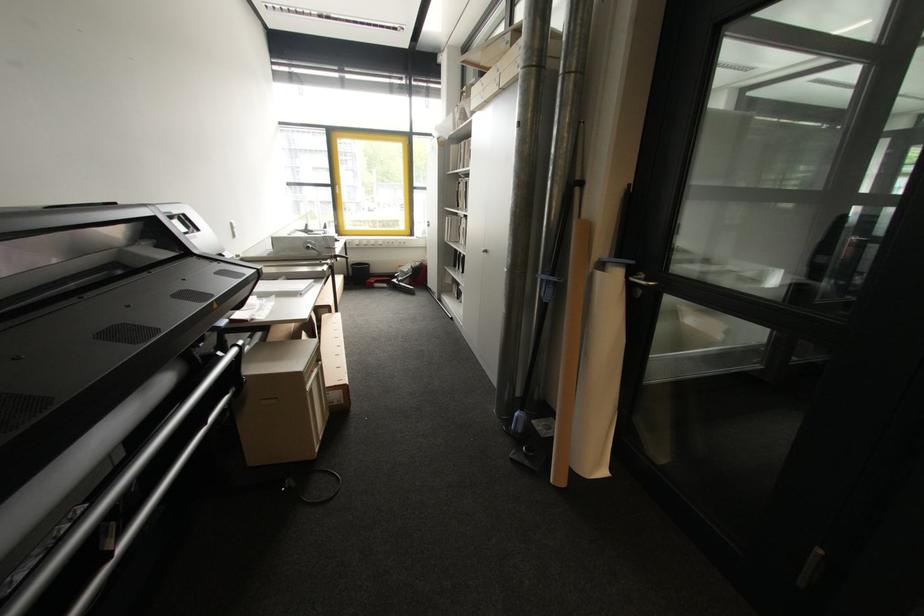
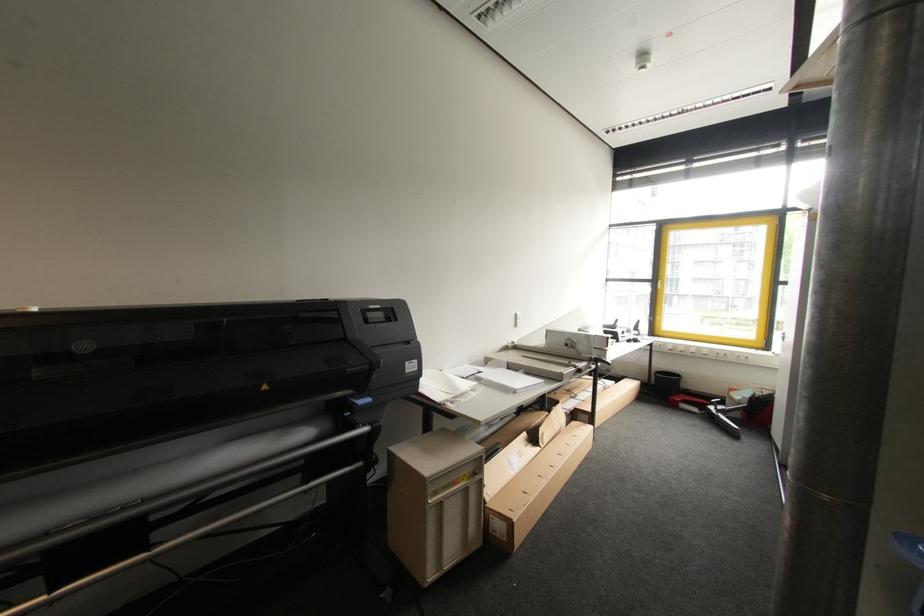
In the second image, find the point that corresponds to (388,286) in the first image.

(699, 411)